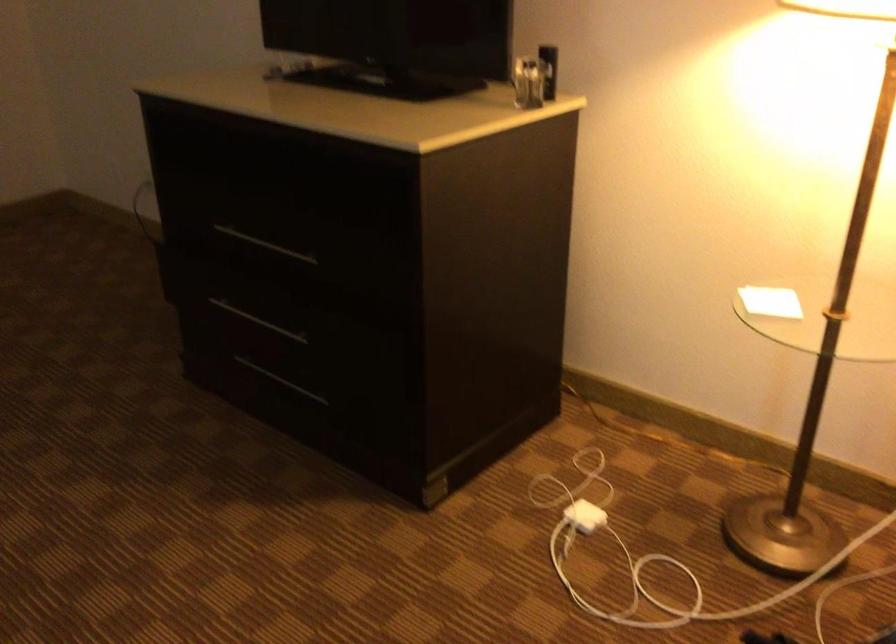
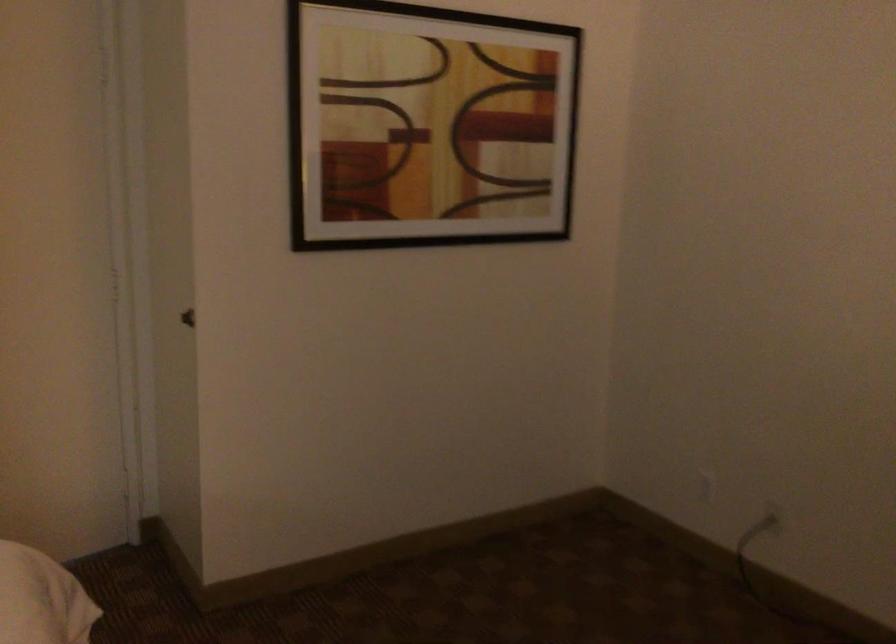
Which direction would the cameraman need to move to produce the second image?

The cameraman moved toward left, forward.